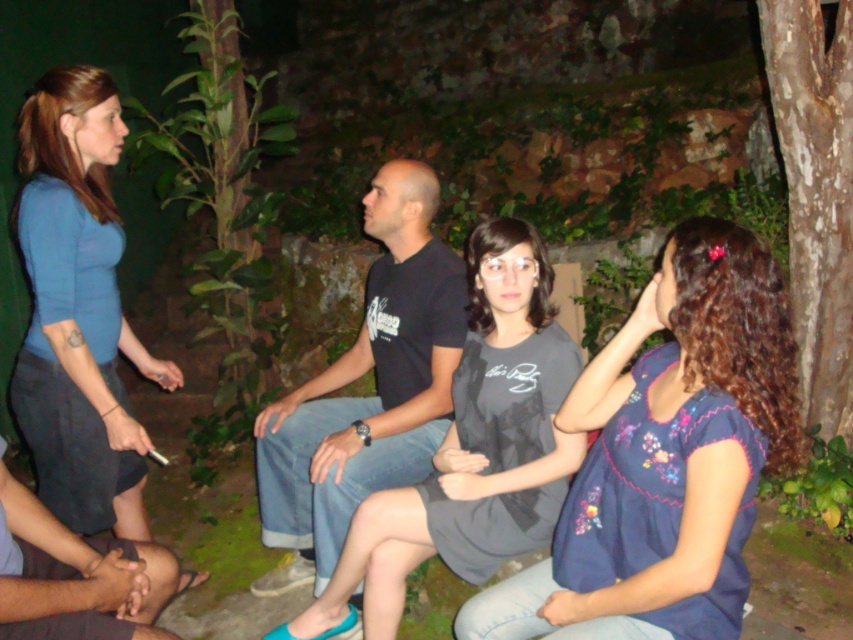
You are a delivery robot with a package that needs to be placed between the blue embroidered blouse at center and the blue fabric shirt at left. The package is 1.5 meters long. Can you fit the package between them?

The distance between the blue embroidered blouse at center and the blue fabric shirt at left is 1.38 meters. Since the package is 1.5 meters long, it cannot fit between them as the space is shorter than the package.

You are a fashion designer observing the image and want to create a layered outfit using the blue embroidered blouse at center and the black cotton shirt at center. Based on their positions in the image, which one should be worn on top to replicate the look?

The blue embroidered blouse at center is below the black cotton shirt at center in the image, so to replicate the look, the black cotton shirt at center should be worn on top of the blue embroidered blouse at center.

In the scene shown: You are a photographer trying to capture a candid shot of the black cotton shirt at center and the smooth black hands at lower left. Which object is wider when viewed from your camera lens?

The black cotton shirt at center is wider than the smooth black hands at lower left, so when viewed from the camera lens, the black cotton shirt at center appears wider.